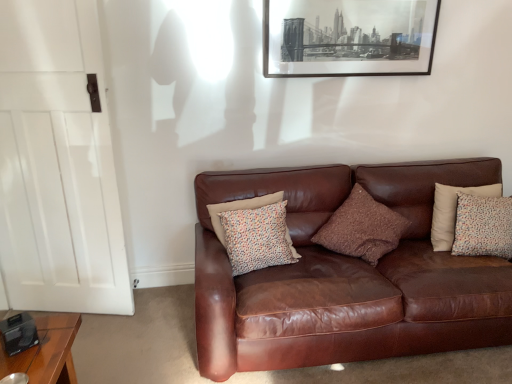
Question: Is black matte picture frame at upper center to the right of brown textured pillow at center, acting as the second pillow starting from the left, from the viewer's perspective?

Choices:
 (A) yes
 (B) no

Answer: (B)

Question: Is the surface of black matte picture frame at upper center in direct contact with brown textured pillow at center, acting as the second pillow starting from the left?

Choices:
 (A) yes
 (B) no

Answer: (B)

Question: Is black matte picture frame at upper center taller than brown textured pillow at center, acting as the second pillow starting from the left?

Choices:
 (A) no
 (B) yes

Answer: (A)

Question: Is black matte picture frame at upper center further to camera compared to brown textured pillow at center, the second pillow positioned from the right?

Choices:
 (A) no
 (B) yes

Answer: (B)

Question: Is black matte picture frame at upper center positioned in front of brown textured pillow at center, acting as the second pillow starting from the left?

Choices:
 (A) yes
 (B) no

Answer: (B)

Question: From a real-world perspective, is brown wooden table at lower left above or below white wood door at left?

Choices:
 (A) above
 (B) below

Answer: (B)

Question: Considering the positions of brown wooden table at lower left and white wood door at left in the image, is brown wooden table at lower left bigger or smaller than white wood door at left?

Choices:
 (A) big
 (B) small

Answer: (B)

Question: Considering the relative positions of brown wooden table at lower left and white wood door at left in the image provided, is brown wooden table at lower left to the left or to the right of white wood door at left?

Choices:
 (A) left
 (B) right

Answer: (B)

Question: Considering the positions of brown wooden table at lower left and white wood door at left in the image, is brown wooden table at lower left wider or thinner than white wood door at left?

Choices:
 (A) wide
 (B) thin

Answer: (A)

Question: Based on their sizes in the image, would you say patterned fabric pillow at right, which is the 1th pillow in right-to-left order, is bigger or smaller than brown textured pillow at center, the second pillow positioned from the right?

Choices:
 (A) big
 (B) small

Answer: (B)

Question: Visually, is patterned fabric pillow at right, which is the 1th pillow in right-to-left order, positioned to the left or to the right of brown textured pillow at center, the second pillow positioned from the right?

Choices:
 (A) left
 (B) right

Answer: (B)

Question: Considering their positions, is patterned fabric pillow at right, which is the 1th pillow in right-to-left order, located in front of or behind brown textured pillow at center, acting as the second pillow starting from the left?

Choices:
 (A) behind
 (B) front

Answer: (A)

Question: From the image's perspective, is patterned fabric pillow at right, which appears as the third pillow when viewed from the left, above or below brown textured pillow at center, acting as the second pillow starting from the left?

Choices:
 (A) above
 (B) below

Answer: (A)

Question: In the image, is black matte picture frame at upper center positioned in front of or behind brown leather couch at center?

Choices:
 (A) behind
 (B) front

Answer: (A)

Question: From the image's perspective, relative to brown leather couch at center, is black matte picture frame at upper center above or below?

Choices:
 (A) above
 (B) below

Answer: (A)